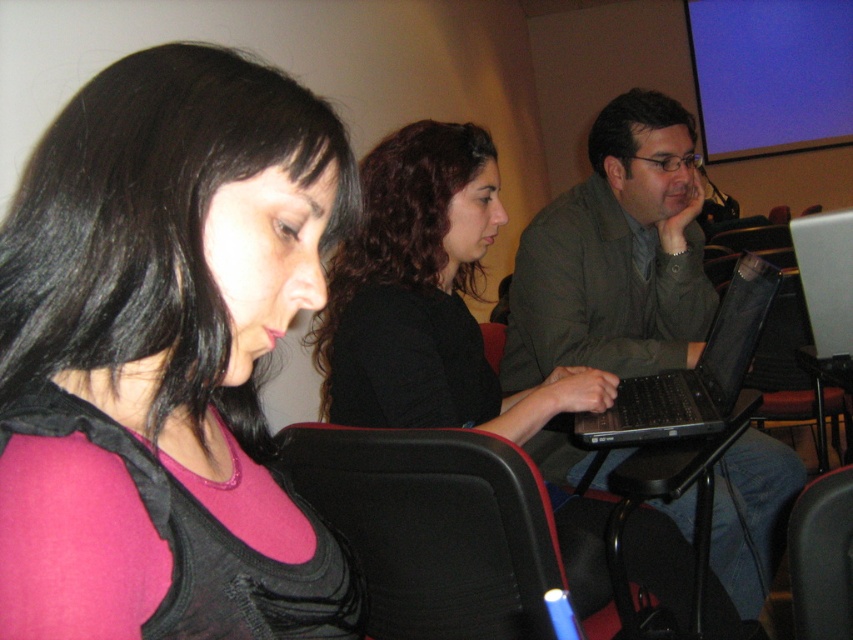
Is point (61, 394) farther from viewer compared to point (693, 340)?

No, it is not.

I want to click on pink matte/black fabric at center, so coord(164,356).

Where is `pink matte/black fabric at center`? pink matte/black fabric at center is located at coordinates (164, 356).

Locate an element on the screen. pink matte/black fabric at center is located at coordinates (164, 356).

Who is positioned more to the right, pink matte/black fabric at center or black matte laptop at center?

Positioned to the right is black matte laptop at center.

Can you confirm if pink matte/black fabric at center is positioned below black matte laptop at center?

Incorrect, pink matte/black fabric at center is not positioned below black matte laptop at center.

Where is `pink matte/black fabric at center`? The width and height of the screenshot is (853, 640). pink matte/black fabric at center is located at coordinates (164, 356).

Does point (665, 161) come behind point (634, 397)?

That is True.

Does matte gray jacket at center have a lesser height compared to black matte laptop at center?

Incorrect, matte gray jacket at center's height does not fall short of black matte laptop at center's.

Is point (746, 449) positioned behind point (631, 397)?

Yes, point (746, 449) is behind point (631, 397).

Locate an element on the screen. matte gray jacket at center is located at coordinates (614, 256).